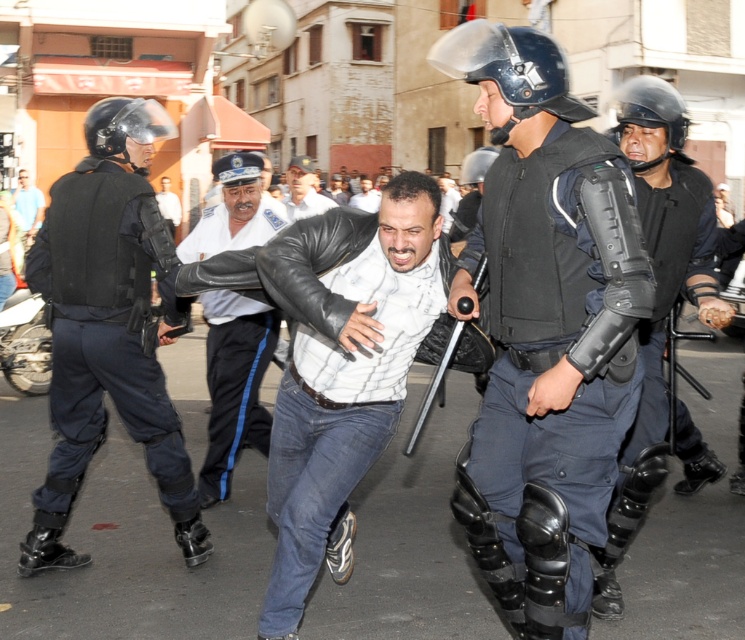
You are a photographer trying to capture the black matte helmet at upper right in the image. Where exactly should you focus your camera to ensure it is centered in your shot?

The black matte helmet at upper right is located at point (650,115), so you should focus your camera there to center it.

You are an observer standing at the edge of the scene. You notice two individuals at the center wearing a leather jacket at center and a white shirt at center. Which individual is positioned to the right of the other?

The leather jacket at center is positioned on the right side of white shirt at center, so the individual wearing the leather jacket at center is to the right of the one in the white shirt at center.

You are a police officer trying to determine which helmet to choose for a patrol in a narrow alley. The black matte helmet at center is narrower than the glossy plastic helmet at center. Which helmet would allow for better maneuverability in tight spaces?

The black matte helmet at center has a smaller width compared to the glossy plastic helmet at center, making it more suitable for maneuvering in tight spaces like narrow alleys.